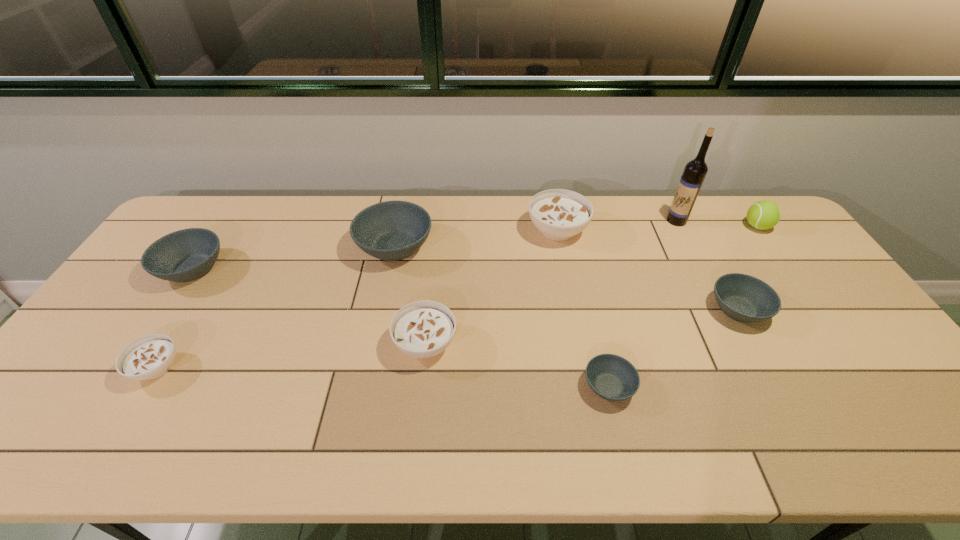
Locate an element on the screen. The image size is (960, 540). free space between the third gray soup bowl from right to left and the leftmost white soup bowl is located at coordinates (276, 307).

Identify the location of free space between the tallest object and the second gray soup bowl from left to right. This screenshot has height=540, width=960. (536, 234).

Image resolution: width=960 pixels, height=540 pixels. What are the coordinates of `free point between the second smallest gray soup bowl and the second smallest white soup bowl` in the screenshot? It's located at (582, 327).

Locate an element on the screen. The image size is (960, 540). free space between the green tennis ball and the rightmost gray soup bowl is located at coordinates (748, 268).

Locate an element on the screen. Image resolution: width=960 pixels, height=540 pixels. object that is the second closest to the green tennis ball is located at coordinates (744, 298).

Select which object is the seventh closest to the second white soup bowl from left to right. Please provide its 2D coordinates. Your answer should be formatted as a tuple, i.e. [(x, y)], where the tuple contains the x and y coordinates of a point satisfying the conditions above.

[(694, 173)]

In order to click on soup bowl that is the fifth nearest to the smallest gray soup bowl in this screenshot , I will do `click(149, 357)`.

The width and height of the screenshot is (960, 540). Identify the location of the second closest soup bowl relative to the second white soup bowl from right to left. (612, 377).

This screenshot has height=540, width=960. Find the location of `white soup bowl that is the third nearest to the rightmost soup bowl`. white soup bowl that is the third nearest to the rightmost soup bowl is located at coordinates (149, 357).

Where is `the second closest white soup bowl relative to the second biggest gray soup bowl`? the second closest white soup bowl relative to the second biggest gray soup bowl is located at coordinates (422, 329).